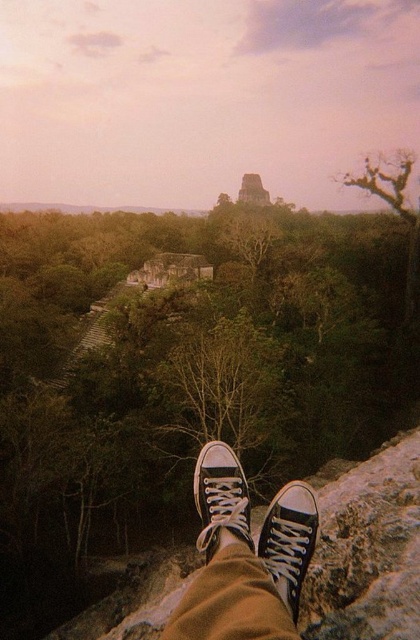
Is black canvas sneakers at lower center closer to camera compared to dark gray stone pyramid at center?

Yes, black canvas sneakers at lower center is closer to the viewer.

Does black canvas sneakers at lower center have a larger size compared to dark gray stone pyramid at center?

No.

Who is more distant from viewer, (209, 609) or (246, 193)?

The point (246, 193) is behind.

At what (x,y) coordinates should I click in order to perform the action: click on black canvas sneakers at lower center. Please return your answer as a coordinate pair (x, y). Looking at the image, I should click on (244, 556).

Who is higher up, black canvas shoe at lower center or black canvas shoe at center?

black canvas shoe at lower center is above.

Does point (293, 550) lie in front of point (231, 499)?

That is True.

Find the location of a particular element. black canvas shoe at lower center is located at coordinates (289, 540).

Who is more forward, [225,556] or [298,483]?

Point [225,556] is more forward.

Between black canvas sneakers at lower center and black canvas shoe at lower center, which one appears on the left side from the viewer's perspective?

black canvas sneakers at lower center

Who is more forward, [202,483] or [291,488]?

Positioned in front is point [291,488].

Where is `black canvas sneakers at lower center`? This screenshot has width=420, height=640. black canvas sneakers at lower center is located at coordinates (244, 556).